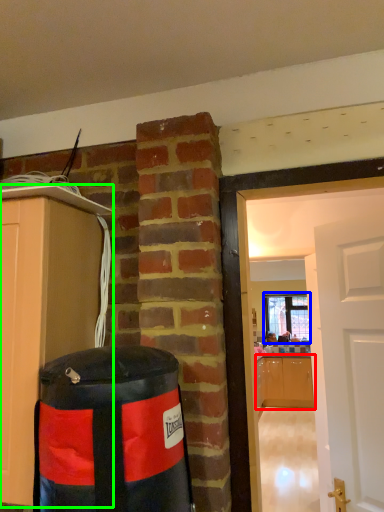
Question: Which object is the closest to the cabinetry (highlighted by a red box)? Choose among these: window (highlighted by a blue box) or cabinetry (highlighted by a green box).

Choices:
 (A) window
 (B) cabinetry

Answer: (A)